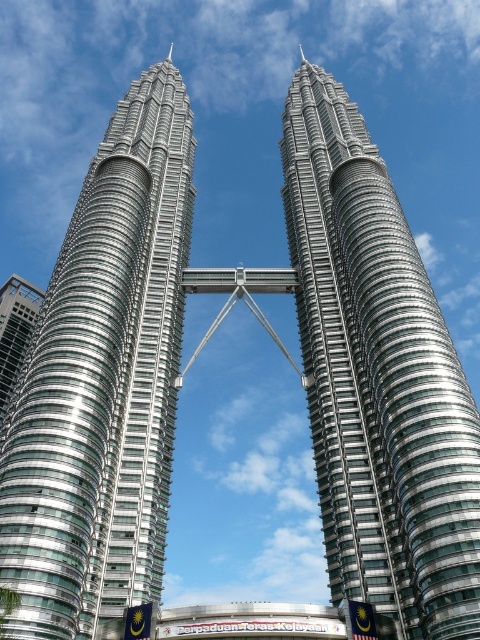
Does silver metallic twin towers at left have a larger size compared to glassy steel skyscraper at left?

Yes.

Is point (119, 448) behind point (24, 308)?

No, it is in front of (24, 308).

Is point (100, 198) less distant than point (6, 390)?

Yes, point (100, 198) is in front of point (6, 390).

The height and width of the screenshot is (640, 480). I want to click on silver metallic twin towers at left, so 103,381.

Who is higher up, silver metallic twin towers at left or silver glass skyscraper at center?

silver metallic twin towers at left is higher up.

Is silver metallic twin towers at left smaller than silver glass skyscraper at center?

No, silver metallic twin towers at left is not smaller than silver glass skyscraper at center.

Does point (48, 577) come behind point (361, 424)?

No, (48, 577) is closer to viewer.

The image size is (480, 640). Identify the location of silver metallic twin towers at left. (103, 381).

Is point (446, 573) positioned behind point (4, 326)?

That is False.

Between point (396, 556) and point (11, 348), which one is positioned behind?

The point (11, 348) is more distant.

Find the location of `silver glass skyscraper at center`. silver glass skyscraper at center is located at coordinates pyautogui.click(x=377, y=378).